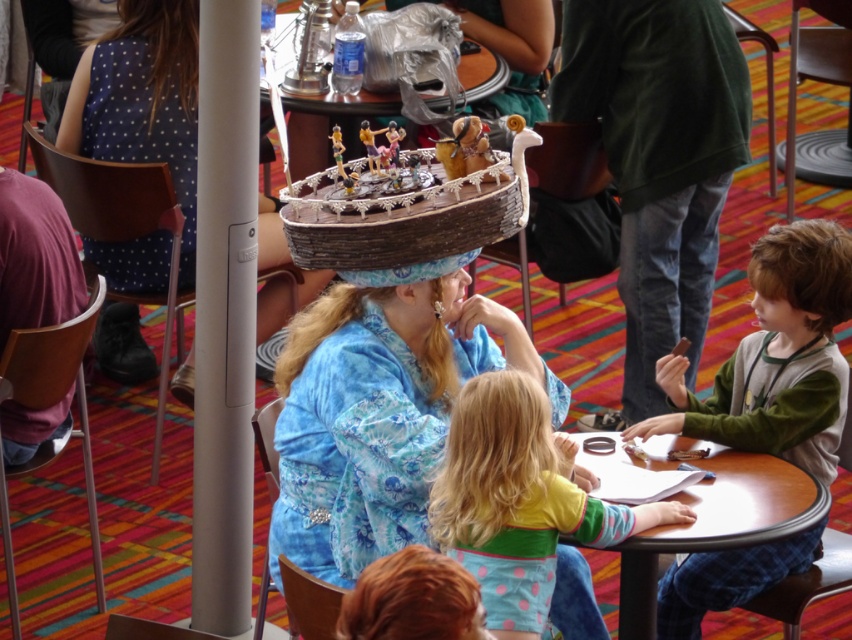
Question: Which object is closer to the camera taking this photo?

Choices:
 (A) smooth wooden table at center
 (B) blue fabric hat at center
 (C) green fleece shirt at lower right
 (D) wooden cake at center

Answer: (A)

Question: Estimate the real-world distances between objects in this image. Which object is closer to the wooden boat at center?

Choices:
 (A) wooden cake at center
 (B) smooth wooden table at center

Answer: (B)

Question: Is green fleece shirt at lower right positioned before wooden boat at center?

Choices:
 (A) no
 (B) yes

Answer: (A)

Question: Which point is farther to the camera?

Choices:
 (A) blue fabric hat at center
 (B) wooden cake at center

Answer: (B)

Question: Is green fleece shirt at lower right to the right of wooden cake at center from the viewer's perspective?

Choices:
 (A) no
 (B) yes

Answer: (B)

Question: Observing the image, what is the correct spatial positioning of pastel polka dot dress at lower center in reference to smooth wooden table at center?

Choices:
 (A) left
 (B) right

Answer: (A)